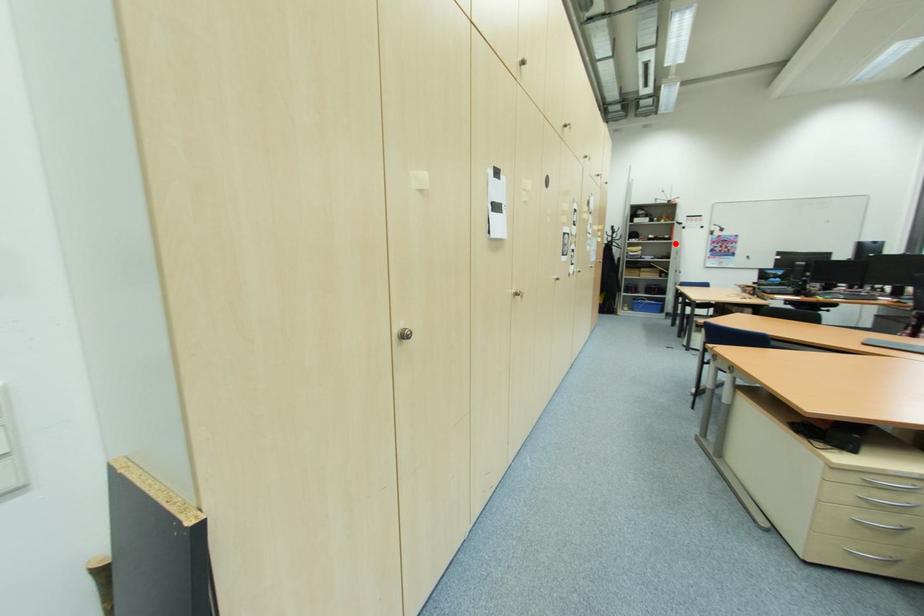
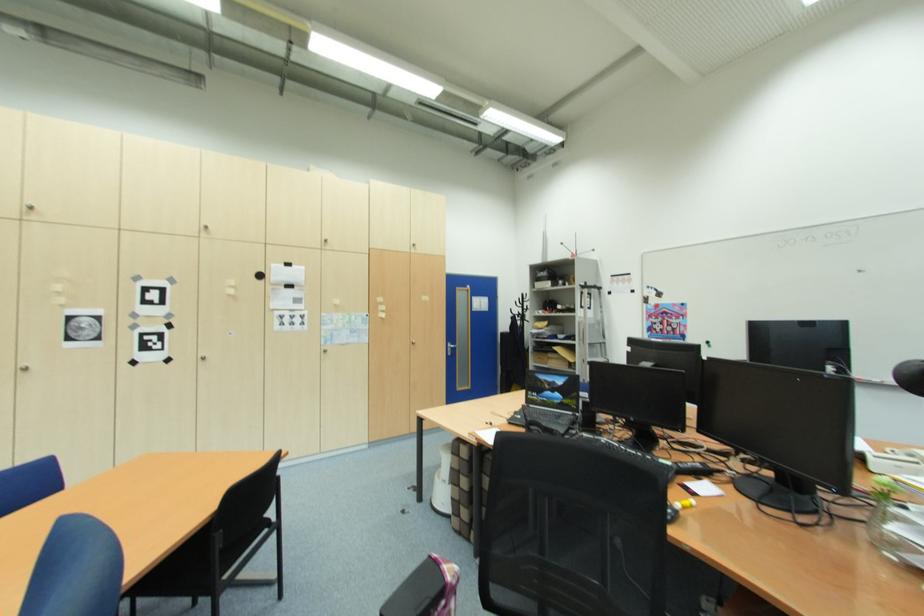
Locate, in the second image, the point that corresponds to the highlighted location in the first image.

(578, 317)